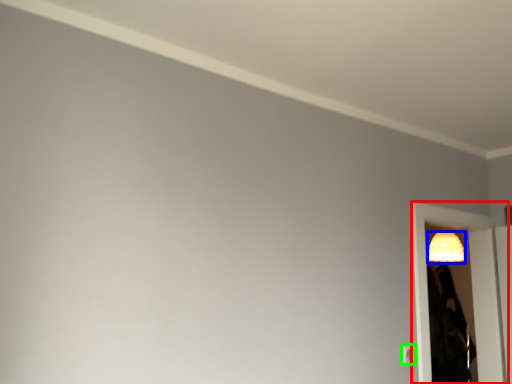
Question: Which object is the closest to the screen door (highlighted by a red box)? Choose among these: lamp (highlighted by a blue box) or light switch (highlighted by a green box).

Choices:
 (A) lamp
 (B) light switch

Answer: (A)